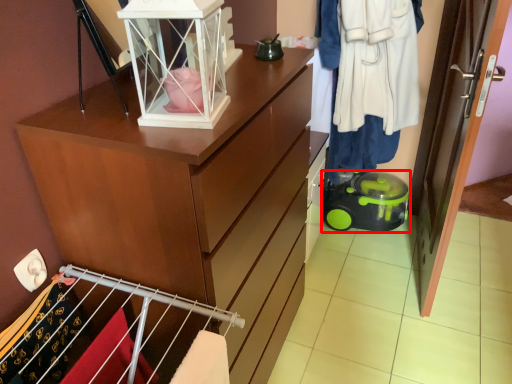
Question: From the image, what is the correct spatial relationship of toy (annotated by the red box) in relation to clothing?

Choices:
 (A) left
 (B) right

Answer: (B)